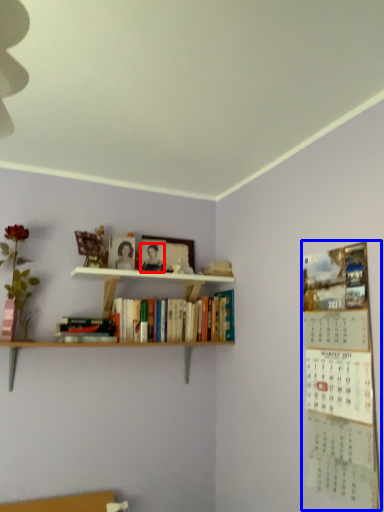
Question: Which object is closer to the camera taking this photo, person (highlighted by a red box) or bulletin board (highlighted by a blue box)?

Choices:
 (A) person
 (B) bulletin board

Answer: (B)